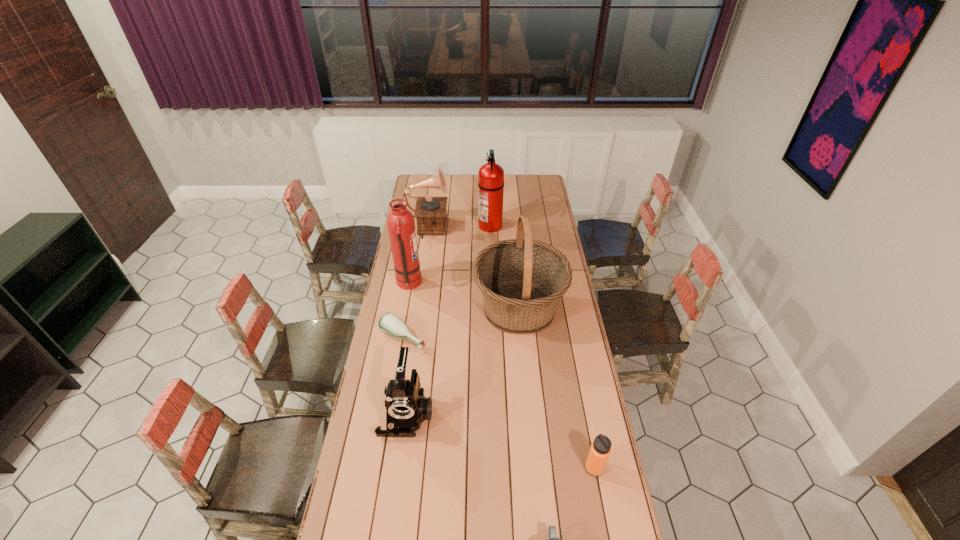
Locate an element on the screen. The height and width of the screenshot is (540, 960). the right fire extinguisher is located at coordinates (490, 175).

This screenshot has height=540, width=960. In order to click on basket in this screenshot , I will do `click(522, 280)`.

The width and height of the screenshot is (960, 540). What are the coordinates of `the nearer fire extinguisher` in the screenshot? It's located at (401, 225).

The image size is (960, 540). In order to click on record player in this screenshot , I will do `click(430, 212)`.

Locate an element on the screen. This screenshot has height=540, width=960. the sixth farthest object is located at coordinates (406, 406).

Locate an element on the screen. Image resolution: width=960 pixels, height=540 pixels. the fourth shortest object is located at coordinates (406, 406).

Identify the location of thermos bottle. The width and height of the screenshot is (960, 540). (600, 449).

Locate an element on the screen. The height and width of the screenshot is (540, 960). the third shortest object is located at coordinates (600, 449).

The image size is (960, 540). What are the coordinates of `bottle` in the screenshot? It's located at (392, 325).

Where is `blank area located at the nozzle of the farther fire extinguisher`? blank area located at the nozzle of the farther fire extinguisher is located at coordinates (469, 225).